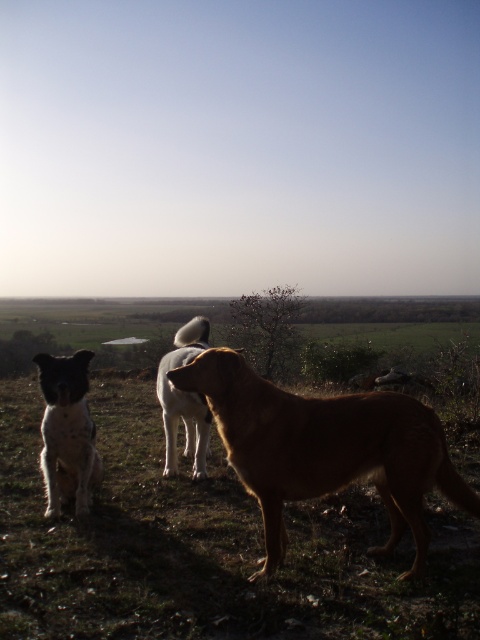
You are standing in the field and see the white fur dog at left and the white fur dog at center. Which dog is positioned higher relative to the other?

The white fur dog at left is positioned higher than the white fur dog at center.